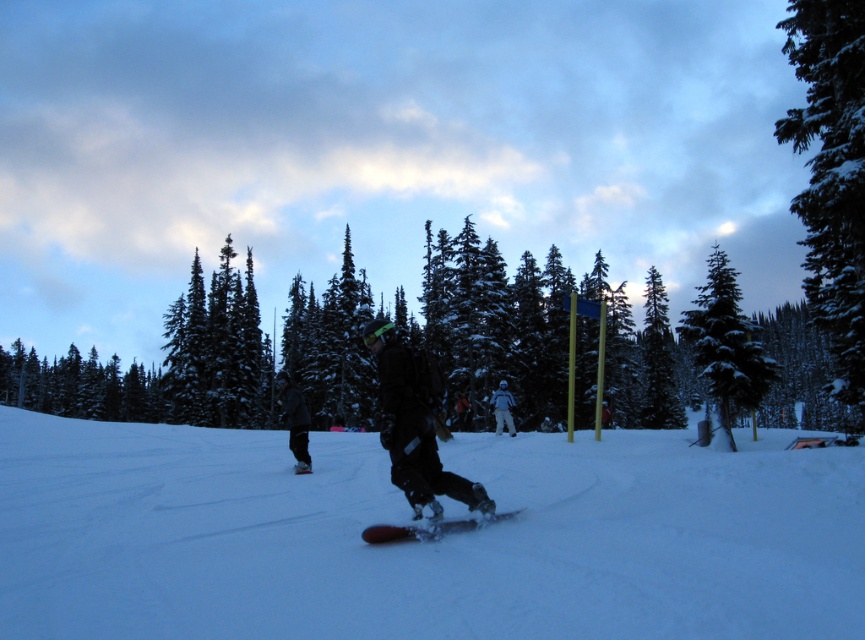
Who is shorter, green matte tree at upper left or snow-covered evergreen at center-right?

green matte tree at upper left

Which is more to the left, green matte tree at upper left or snow-covered evergreen at center-right?

green matte tree at upper left is more to the left.

This screenshot has height=640, width=865. Describe the element at coordinates (81, 387) in the screenshot. I see `green matte tree at upper left` at that location.

Identify the location of green matte tree at upper left. This screenshot has width=865, height=640. (81, 387).

Which is below, green matte tree at upper left or white matte snowboarder at center?

green matte tree at upper left is lower down.

Is point (90, 410) more distant than point (510, 428)?

Yes, it is behind point (510, 428).

Which is in front, point (168, 412) or point (498, 424)?

Positioned in front is point (498, 424).

This screenshot has width=865, height=640. Identify the location of green matte tree at upper left. (81, 387).

Is point (809, 70) farther from viewer compared to point (389, 529)?

That is True.

Which is more to the right, snowy evergreen tree at right or red matte snowboard at center?

Positioned to the right is snowy evergreen tree at right.

Who is more distant from viewer, (806, 129) or (440, 520)?

Point (806, 129)

Find the location of a particular element. This screenshot has width=865, height=640. snowy evergreen tree at right is located at coordinates (831, 176).